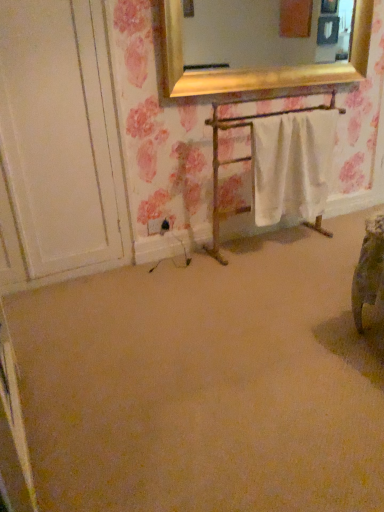
Question: From the image's perspective, does black plastic electric outlet at lower left appear higher than beige carpet at center?

Choices:
 (A) yes
 (B) no

Answer: (A)

Question: Is black plastic electric outlet at lower left far from beige carpet at center?

Choices:
 (A) no
 (B) yes

Answer: (B)

Question: Does black plastic electric outlet at lower left have a lesser width compared to beige carpet at center?

Choices:
 (A) yes
 (B) no

Answer: (A)

Question: From the image's perspective, does black plastic electric outlet at lower left appear lower than beige carpet at center?

Choices:
 (A) no
 (B) yes

Answer: (A)

Question: Considering the relative sizes of black plastic electric outlet at lower left and beige carpet at center in the image provided, is black plastic electric outlet at lower left wider than beige carpet at center?

Choices:
 (A) yes
 (B) no

Answer: (B)

Question: Can you confirm if black plastic electric outlet at lower left is taller than beige carpet at center?

Choices:
 (A) no
 (B) yes

Answer: (B)

Question: Is the surface of beige carpet at center in direct contact with white fabric towel rack at center?

Choices:
 (A) yes
 (B) no

Answer: (B)

Question: From the image's perspective, is beige carpet at center on top of white fabric towel rack at center?

Choices:
 (A) yes
 (B) no

Answer: (B)

Question: Is beige carpet at center thinner than white fabric towel rack at center?

Choices:
 (A) no
 (B) yes

Answer: (A)

Question: From a real-world perspective, is beige carpet at center positioned under white fabric towel rack at center based on gravity?

Choices:
 (A) yes
 (B) no

Answer: (A)

Question: Considering the relative sizes of beige carpet at center and white fabric towel rack at center in the image provided, is beige carpet at center shorter than white fabric towel rack at center?

Choices:
 (A) yes
 (B) no

Answer: (A)

Question: Can you confirm if beige carpet at center is wider than white fabric towel rack at center?

Choices:
 (A) no
 (B) yes

Answer: (B)

Question: Is white fabric towel rack at center shorter than black plastic electric outlet at lower left?

Choices:
 (A) no
 (B) yes

Answer: (A)